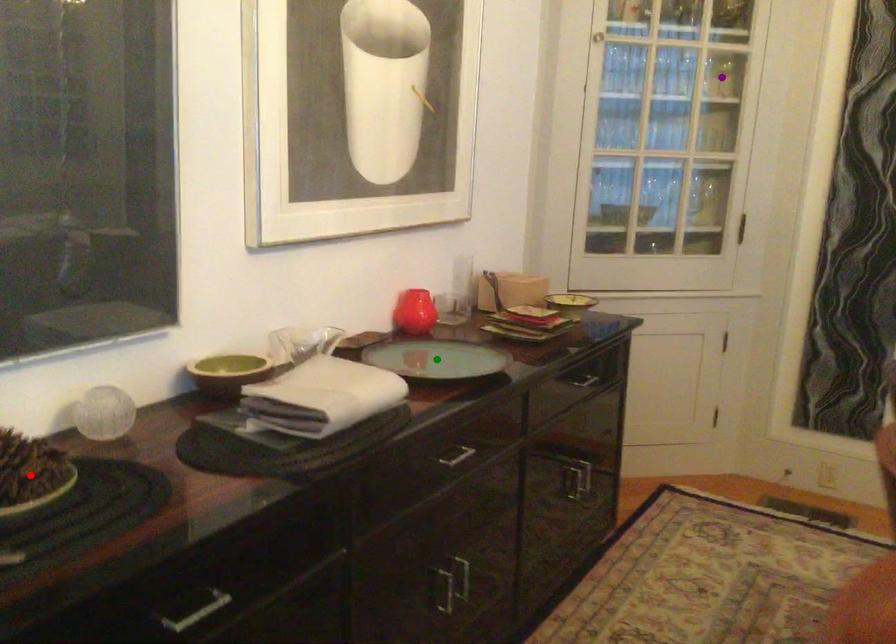
Order these from nearest to farthest:
red point, green point, purple point

1. red point
2. green point
3. purple point